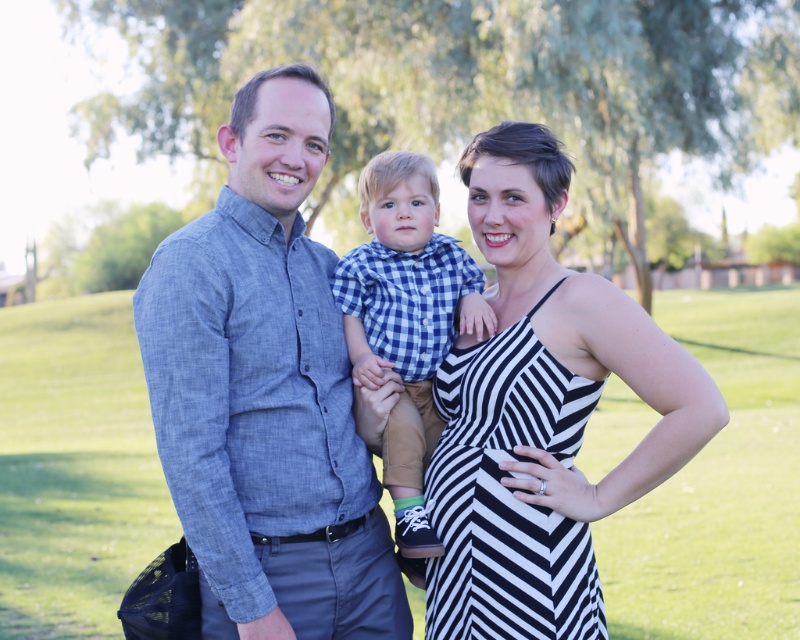
Which is behind, point (692, 440) or point (480, 502)?

The point (480, 502) is more distant.

Can you confirm if blue chambray shirt at center is taller than black and white striped dress at center?

Yes, blue chambray shirt at center is taller than black and white striped dress at center.

Who is more distant from viewer, (316,122) or (496,448)?

The point (316,122) is behind.

You are a GUI agent. You are given a task and a screenshot of the screen. Output one action in this format:
    pyautogui.click(x=<x>, y=<y>)
    Task: Click on the blue chambray shirt at center
    
    Given the screenshot: What is the action you would take?
    pyautogui.click(x=262, y=394)

Is denim shirt at center taller than black and white striped dress at center?

Yes, denim shirt at center is taller than black and white striped dress at center.

Is point (280, 106) more distant than point (550, 292)?

No, (280, 106) is closer to viewer.

This screenshot has height=640, width=800. Identify the location of denim shirt at center. (268, 392).

Between blue chambray shirt at center and blue checkered shirt at center, which one is positioned lower?

blue chambray shirt at center is below.

Can you confirm if blue chambray shirt at center is positioned below blue checkered shirt at center?

Yes, blue chambray shirt at center is below blue checkered shirt at center.

This screenshot has height=640, width=800. I want to click on blue chambray shirt at center, so click(262, 394).

Find the location of a particular element. This screenshot has width=800, height=640. blue chambray shirt at center is located at coordinates (262, 394).